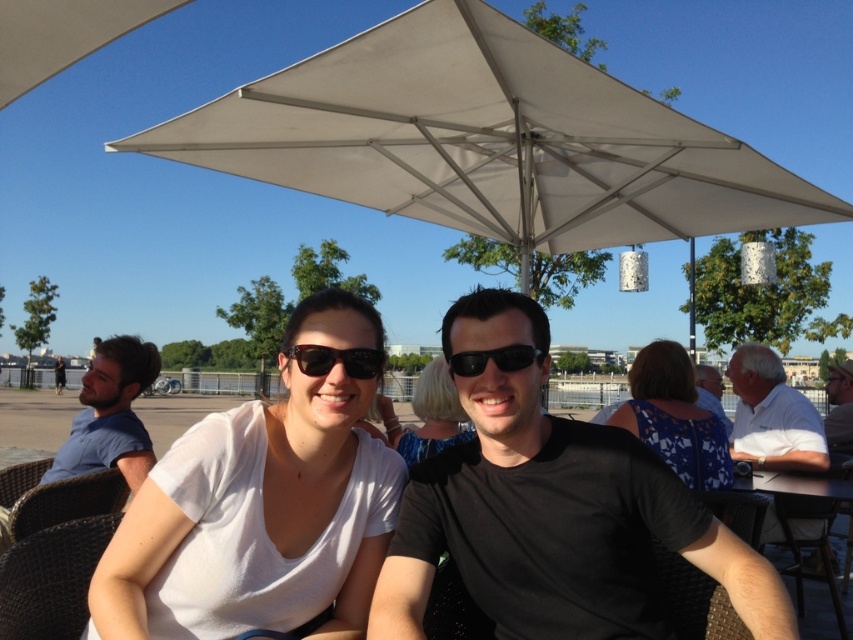
You are standing at the center of the image and want to locate the blonde hair at center. According to the coordinates provided, in which direction should you look to find it?

The blonde hair at center is located at coordinates point 0.650 on the x axis and 0.509 on the y axis. Since the center of the image is at 0.5 on both axes, the blonde hair at center is to the right and slightly above the center point.

You are a photographer standing at the edge of the patio. You want to take a photo of the blonde hair at center without the white fabric umbrella at upper center casting a shadow on it. Is this possible based on the current setup?

The white fabric umbrella at upper center is located above the blonde hair at center, so it will cast a shadow on the blonde hair at center. Therefore, it is not possible to take a photo of the blonde hair at center without the shadow from the umbrella.

You are a photographer standing at the edge of the patio. You want to take a photo of the white fabric umbrella at upper center and the blonde hair at center without any obstructions. Considering their heights, which one might block the view of the other?

The white fabric umbrella at upper center is much taller than the blonde hair at center, so it might block the view of the blonde hair at center if positioned between the photographer and the subject.